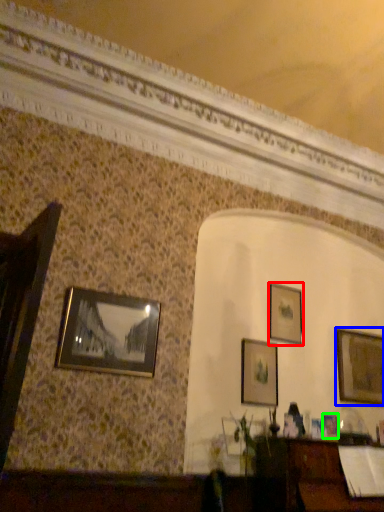
Question: Considering the real-world distances, which object is closest to picture frame (highlighted by a red box)? picture frame (highlighted by a blue box) or picture frame (highlighted by a green box).

Choices:
 (A) picture frame
 (B) picture frame

Answer: (A)